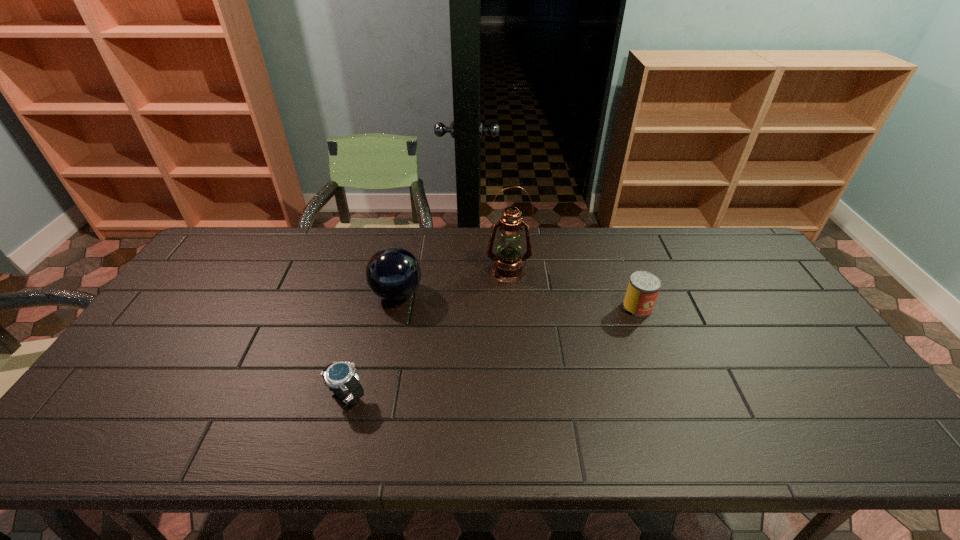
This screenshot has width=960, height=540. Find the location of `oil lamp`. oil lamp is located at coordinates (508, 264).

Image resolution: width=960 pixels, height=540 pixels. Identify the location of the tallest object. (508, 264).

Locate an element on the screen. bowling ball is located at coordinates (393, 273).

Where is `the rightmost object`? The image size is (960, 540). the rightmost object is located at coordinates (643, 288).

Locate an element on the screen. The image size is (960, 540). watch is located at coordinates (340, 377).

The image size is (960, 540). I want to click on free space located on the left of the tallest object, so click(x=415, y=270).

This screenshot has height=540, width=960. I want to click on vacant space located on the side of the bowling ball with the finger holes, so click(492, 294).

Image resolution: width=960 pixels, height=540 pixels. Identify the location of vacant space situated on the back of the rightmost object. (616, 251).

Locate an element on the screen. vacant space located 0.250m on the back of the nearest object is located at coordinates (370, 310).

The width and height of the screenshot is (960, 540). What are the coordinates of `object located in the far edge section of the desktop` in the screenshot? It's located at (508, 264).